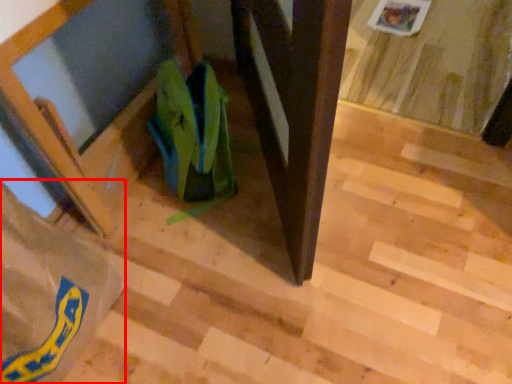
Question: Observing the image, what is the correct spatial positioning of grocery bag (annotated by the red box) in reference to grocery bag?

Choices:
 (A) left
 (B) right

Answer: (A)